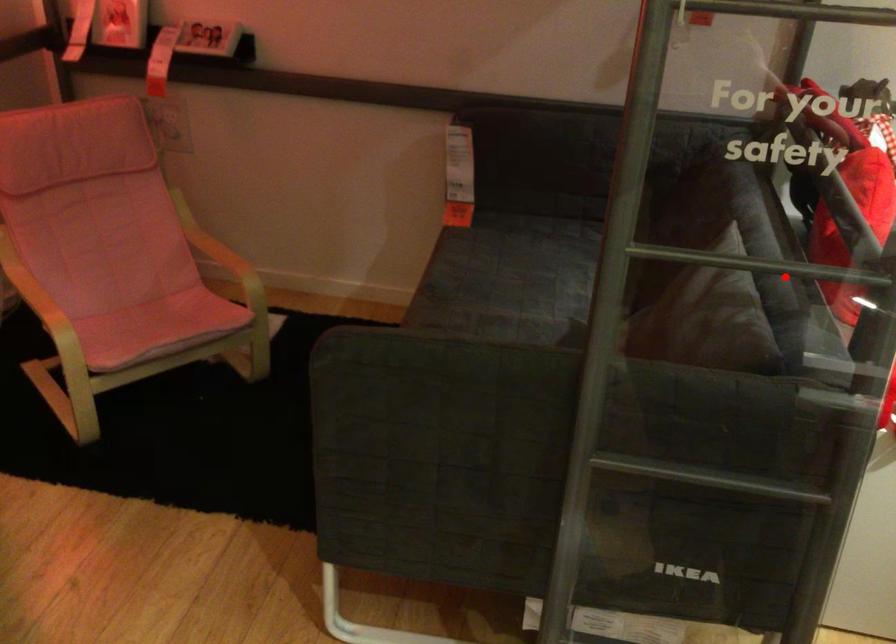
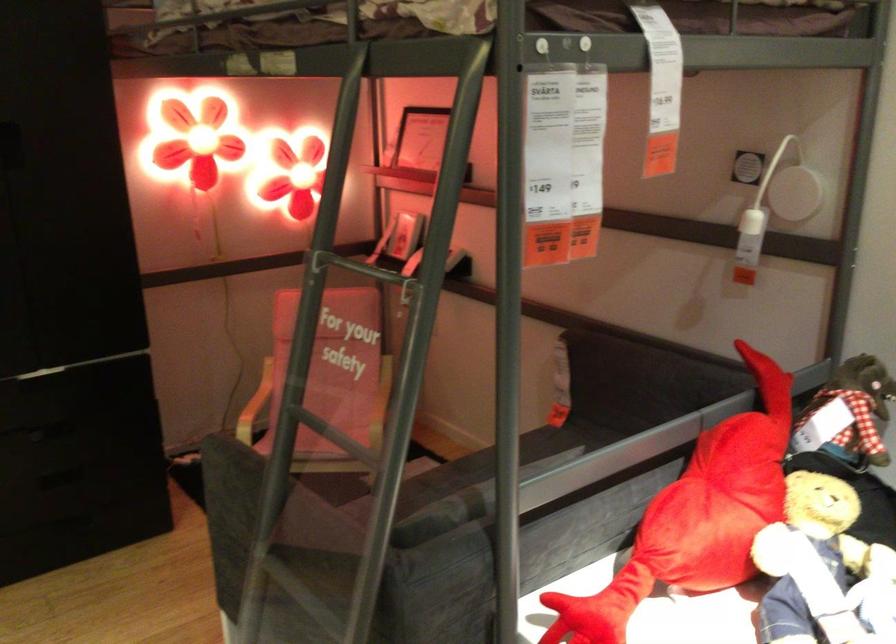
Locate, in the second image, the point that corresponds to the highlighted location in the first image.

(340, 448)